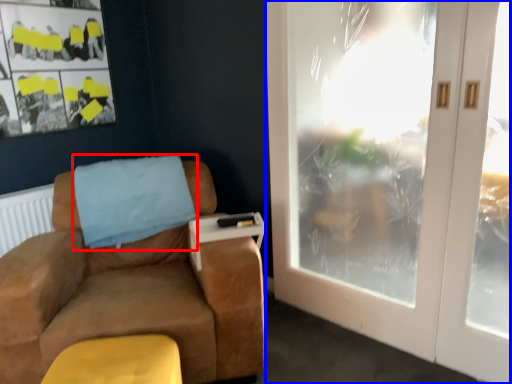
Question: Which point is further to the camera, blanket (highlighted by a red box) or door (highlighted by a blue box)?

Choices:
 (A) blanket
 (B) door

Answer: (A)